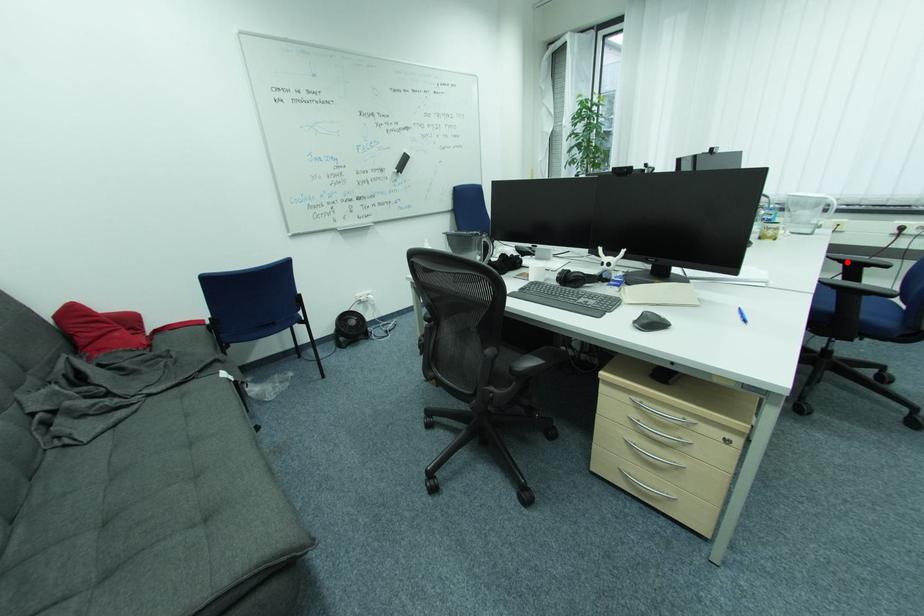
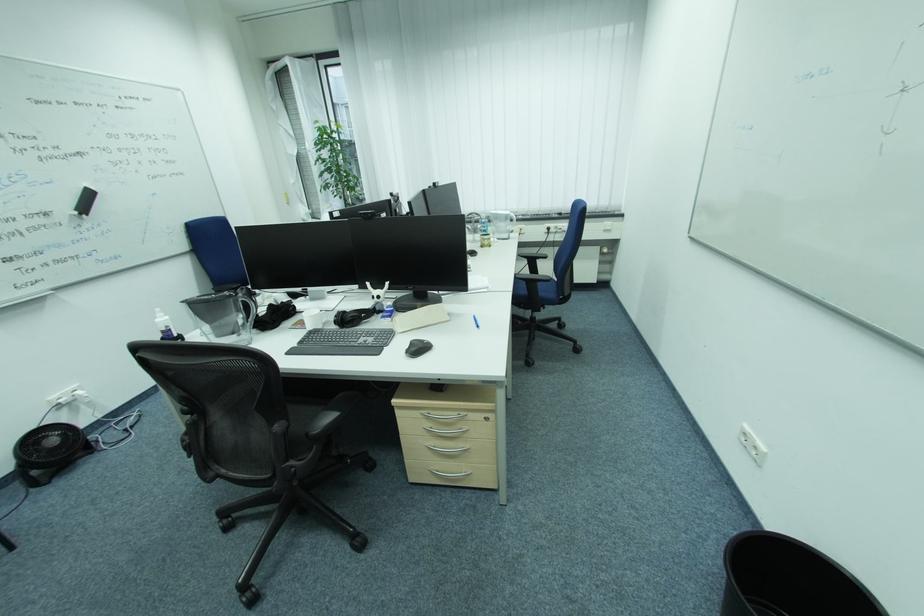
Locate, in the second image, the point that corresponds to the highlighted location in the first image.

(531, 257)